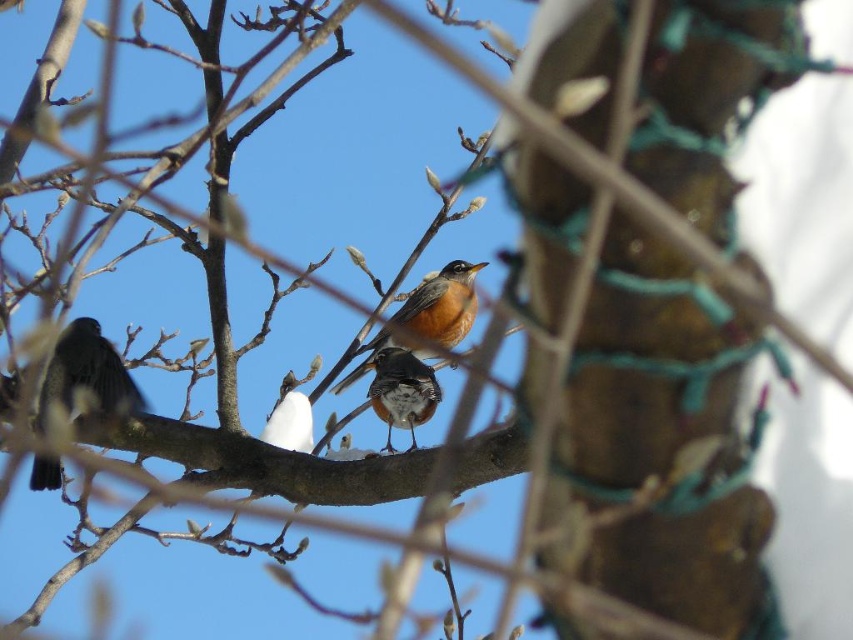
Question: Which point is closer to the camera taking this photo?

Choices:
 (A) (387, 451)
 (B) (456, 307)
 (C) (285, 404)
 (D) (96, 376)

Answer: (C)

Question: Which of the following is the closest to the observer?

Choices:
 (A) (45, 481)
 (B) (281, 428)
 (C) (410, 401)
 (D) (444, 291)

Answer: (A)

Question: Does bright orange bird at center appear under white fluffy bird at center?

Choices:
 (A) no
 (B) yes

Answer: (A)

Question: Which of the following is the farthest from the observer?

Choices:
 (A) (434, 406)
 (B) (473, 300)
 (C) (120, 362)

Answer: (B)

Question: Where is bright orange bird at center located in relation to white fluffy bird at center in the image?

Choices:
 (A) left
 (B) right

Answer: (B)

Question: From the image, what is the correct spatial relationship of bright orange bird at center in relation to brown speckled feathers at center?

Choices:
 (A) right
 (B) left

Answer: (A)